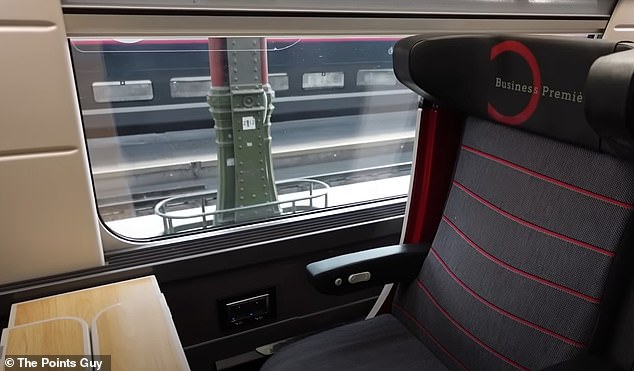
I want to click on chair arm rest, so point(340,270).